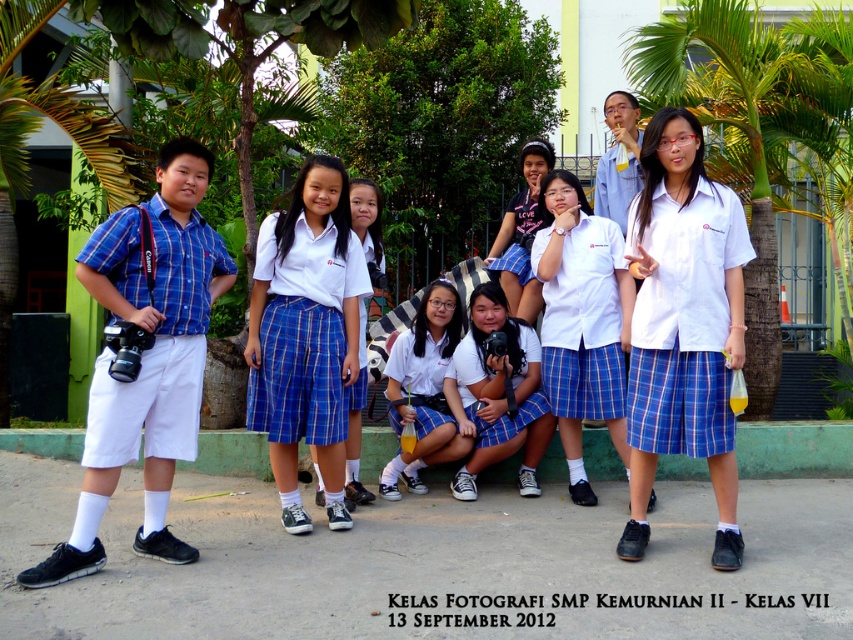
You are standing in the schoolyard and see the blue plaid shirt at left. Where exactly is it positioned in the image?

The blue plaid shirt at left is located at point coordinates of 0.562 on the x axis and 0.172 on the y axis.

You are standing in the schoolyard and want to take a photo of the students. The camera you need is the white matte camera at center. Where should you look to find it?

The white matte camera at center is located at the coordinates point (500, 392).